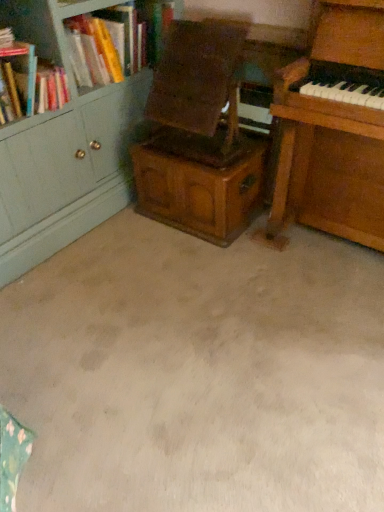
Identify the location of free space in front of wooden cabinet at center. The height and width of the screenshot is (512, 384). (201, 268).